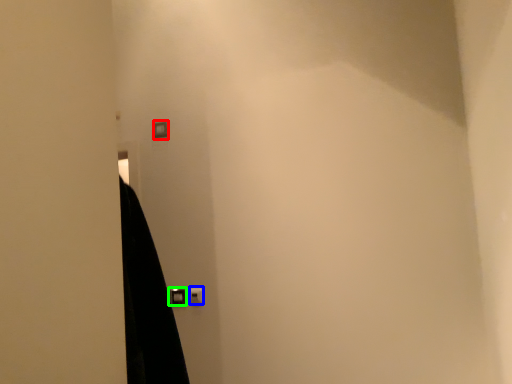
Question: Which object is positioned farthest from light switch (highlighted by a red box)? Select from light switch (highlighted by a blue box) and door handle (highlighted by a green box).

Choices:
 (A) light switch
 (B) door handle

Answer: (A)